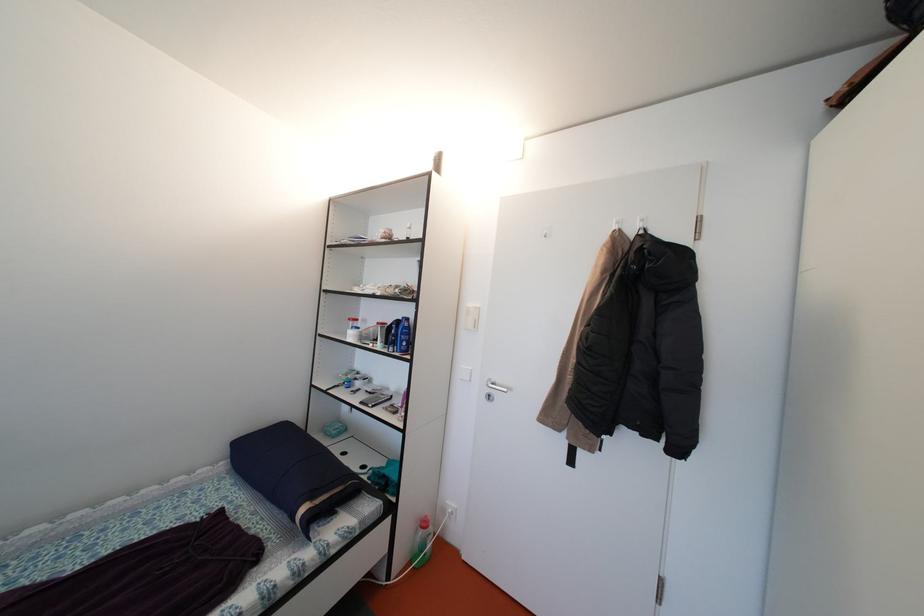
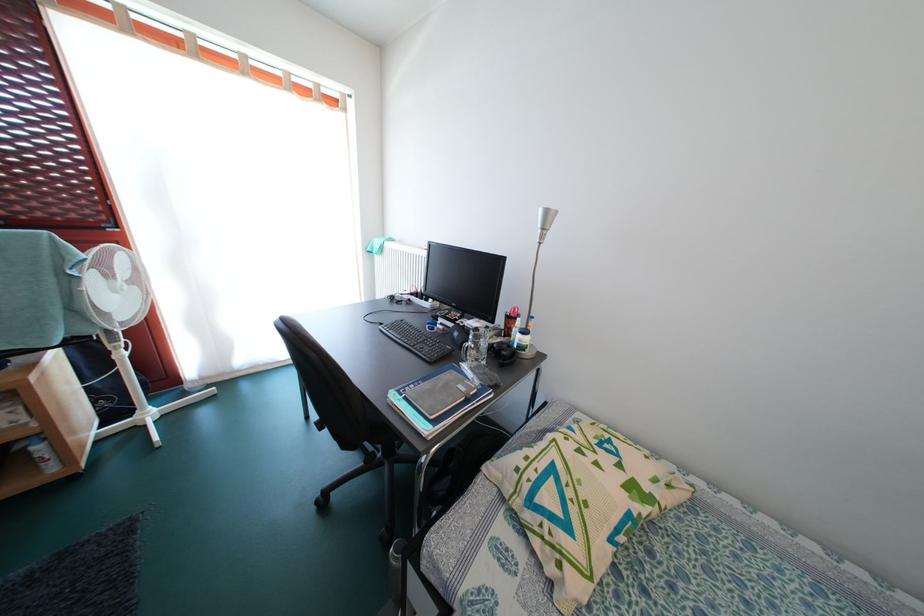
Question: The camera is either moving clockwise (left) or counter-clockwise (right) around the object. The first image is from the beginning of the video and the second image is from the end. Is the camera moving left or right when shooting the video?

Choices:
 (A) Left
 (B) Right

Answer: (B)